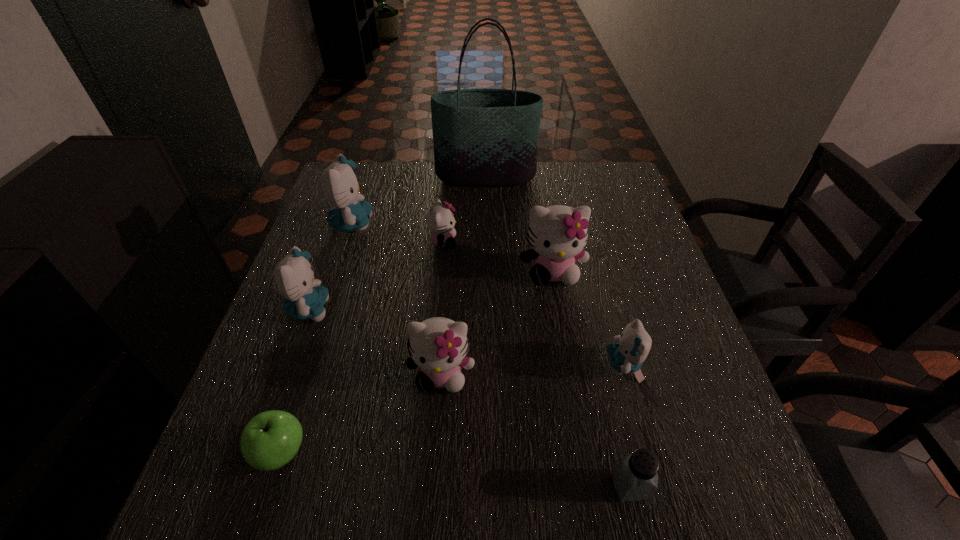
At what (x,y) coordinates should I click in order to perform the action: click on green apple. Please return your answer as a coordinate pair (x, y). Looking at the image, I should click on (271, 439).

Where is `saltshaker`? saltshaker is located at coordinates (635, 477).

Where is `free space located on the front of the tote bag`? The height and width of the screenshot is (540, 960). free space located on the front of the tote bag is located at coordinates (486, 206).

Identify the location of vacant space located 0.220m on the face of the biggest blue kitten. (454, 225).

Locate an element on the screen. vacant position located 0.350m on the front-facing side of the rightmost white kitten is located at coordinates (579, 430).

Image resolution: width=960 pixels, height=540 pixels. In order to click on free space located on the face of the second biggest blue kitten in this screenshot , I will do `click(371, 309)`.

Identify the location of vacant space located on the front-facing side of the second smallest white kitten. This screenshot has height=540, width=960. (430, 531).

At what (x,y) coordinates should I click in order to perform the action: click on free space located 0.070m on the front-facing side of the farthest white kitten. Please return your answer as a coordinate pair (x, y). This screenshot has height=540, width=960. Looking at the image, I should click on (484, 241).

Identify the location of vacant space positioned 0.190m on the face of the nearest blue kitten. This screenshot has width=960, height=540. (513, 364).

Locate an element on the screen. The width and height of the screenshot is (960, 540). free space located 0.270m on the face of the nearest blue kitten is located at coordinates (473, 364).